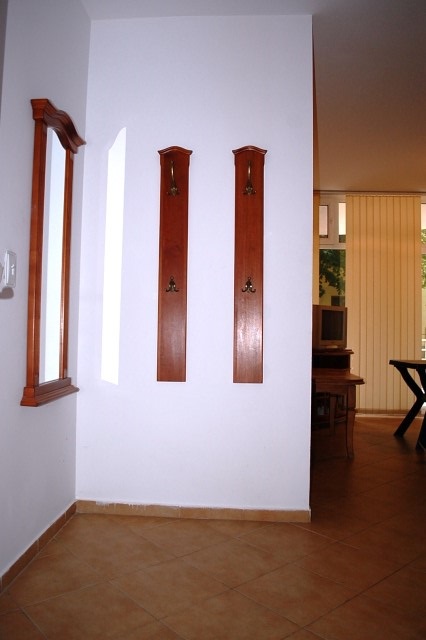
At what (x,y) coordinates should I click in order to perform the action: click on mirror. Please return your answer as a coordinate pair (x, y). The height and width of the screenshot is (640, 426). Looking at the image, I should click on (61, 339).